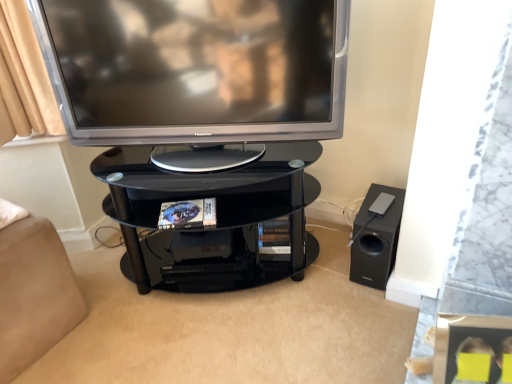
Identify the location of free space in front of black glass shelf at center. The image size is (512, 384). (223, 339).